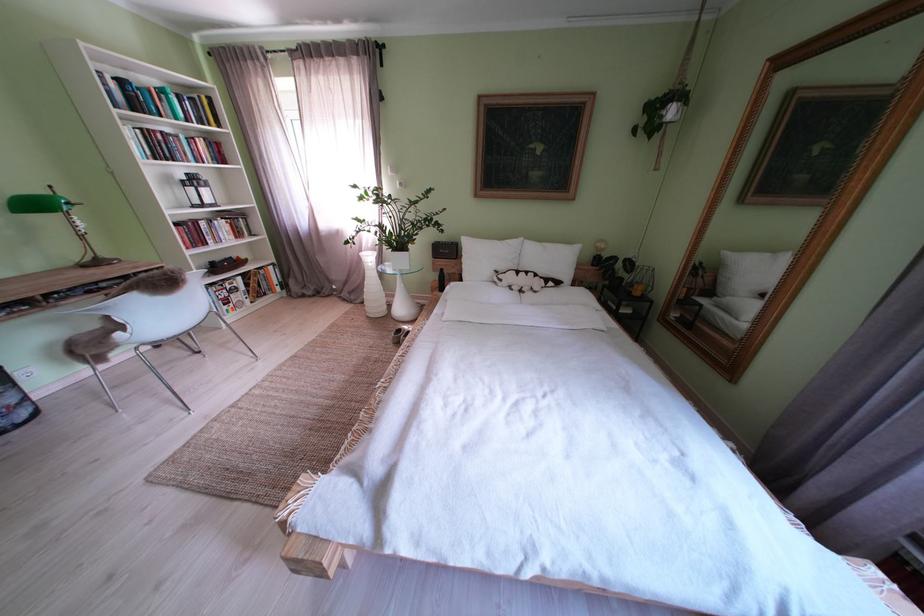
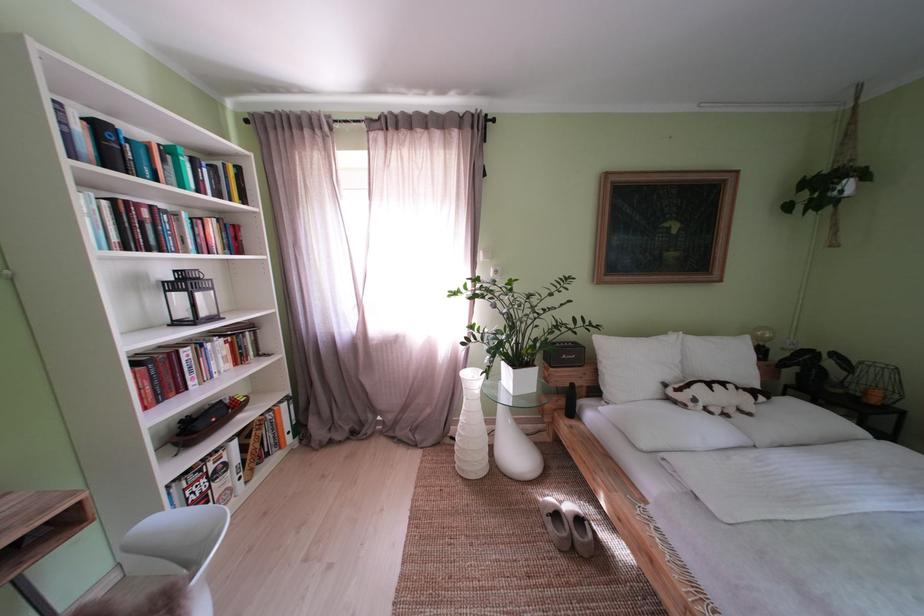
Find the pixel in the second image that matches point 188,142 in the first image.

(188, 220)